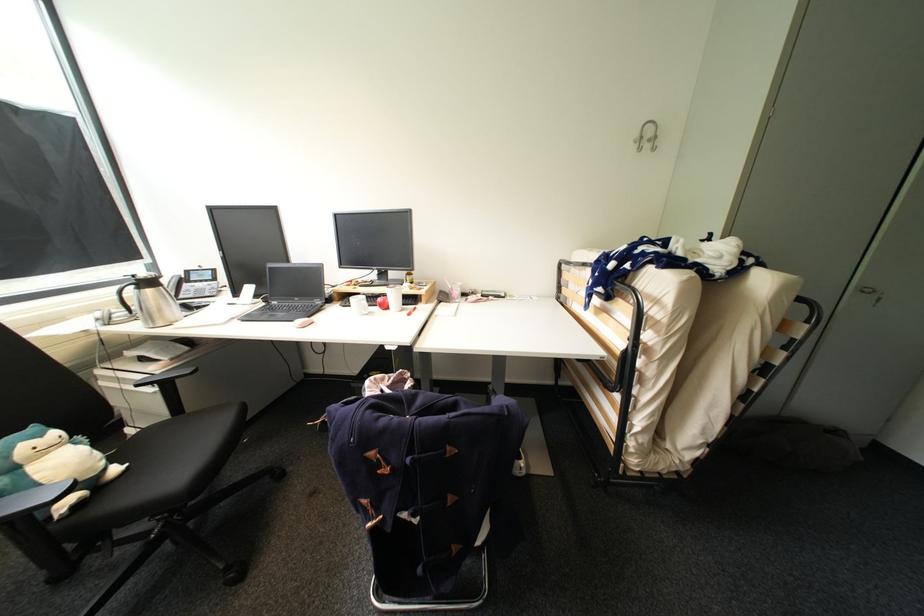
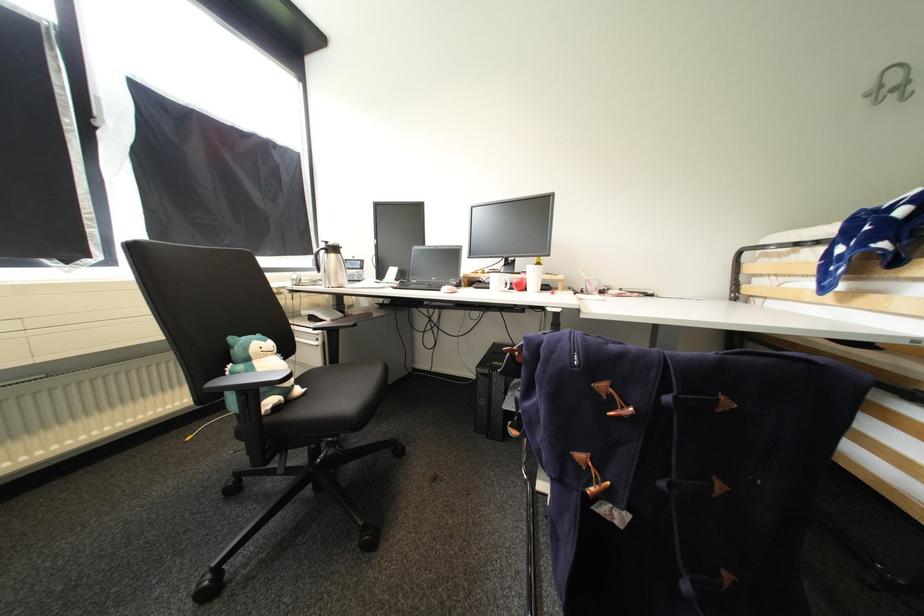
Where in the second image is the point corresponding to (379,455) from the first image?

(610, 387)